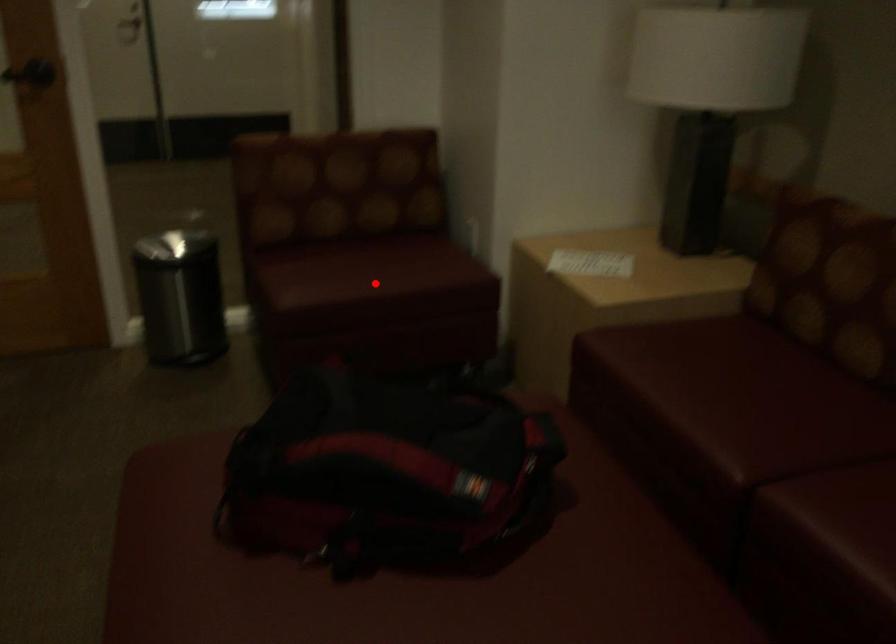
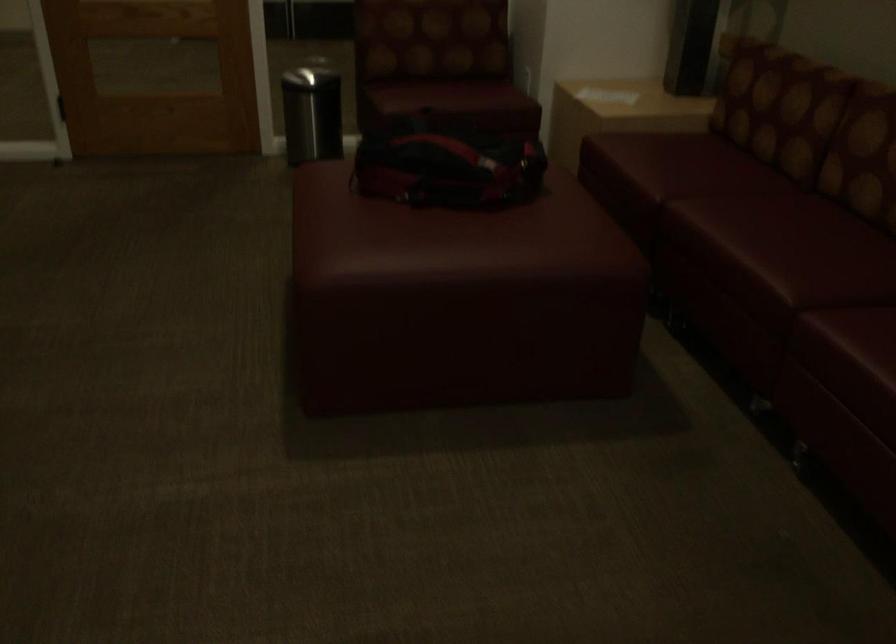
Where in the second image is the point corresponding to the highlighted location from the first image?

(448, 96)